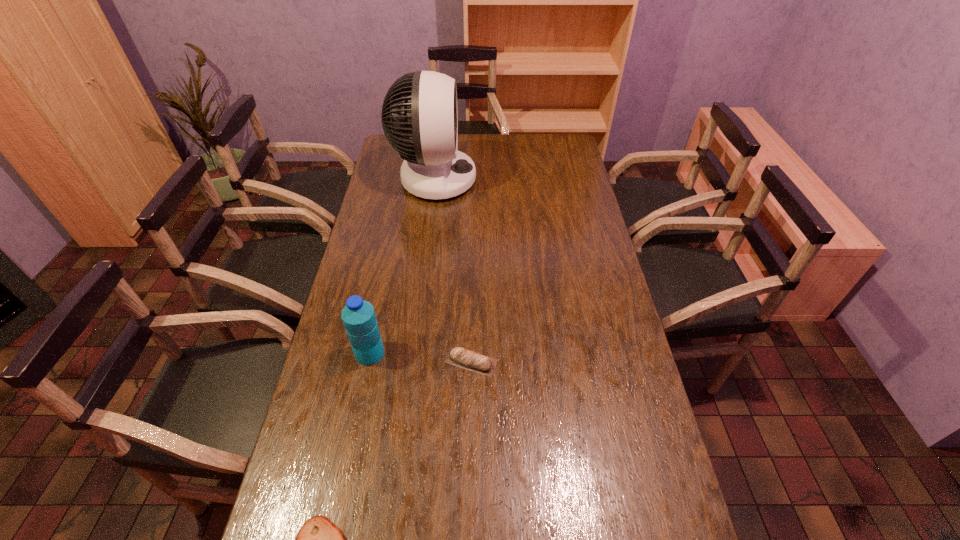
Identify the location of object positioned at the far left corner. The width and height of the screenshot is (960, 540). (433, 168).

Locate an element on the screen. Image resolution: width=960 pixels, height=540 pixels. free space at the far edge of the desktop is located at coordinates (504, 137).

At what (x,y) coordinates should I click in order to perform the action: click on vacant space at the left edge. Please return your answer as a coordinate pair (x, y). This screenshot has height=540, width=960. Looking at the image, I should click on [x=371, y=259].

In order to click on free space at the right edge in this screenshot , I will do [564, 249].

Find the location of `free space at the far right corner of the desktop`. free space at the far right corner of the desktop is located at coordinates pyautogui.click(x=550, y=154).

Find the location of `free space between the farther pita bread and the second tallest object`. free space between the farther pita bread and the second tallest object is located at coordinates (420, 357).

At what (x,y) coordinates should I click in order to perform the action: click on free space between the fan and the farther pita bread. Please return your answer as a coordinate pair (x, y). Looking at the image, I should click on (453, 271).

Find the location of a particular element. Image resolution: width=960 pixels, height=540 pixels. free point between the second tallest object and the right pita bread is located at coordinates (x=420, y=357).

This screenshot has height=540, width=960. Find the location of `free space between the fan and the third shortest object`. free space between the fan and the third shortest object is located at coordinates (402, 266).

Find the location of a particular element. vacant area between the farther pita bread and the farthest object is located at coordinates (453, 271).